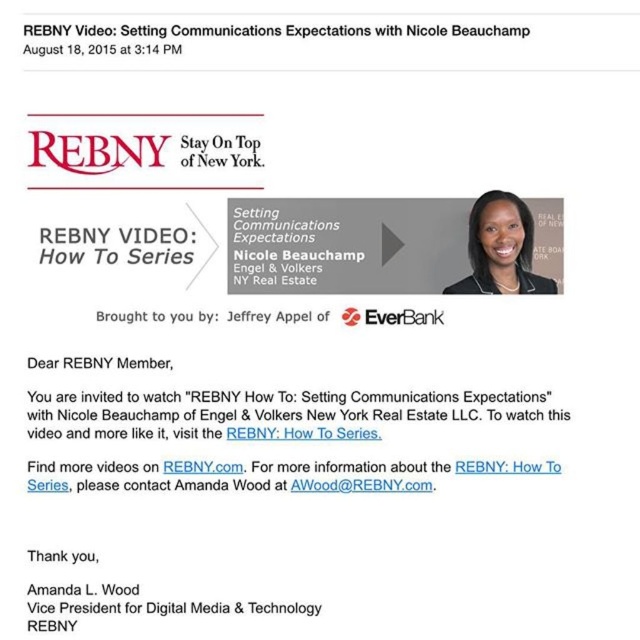
Is point (515, 29) positioned behind point (476, 275)?

No, (515, 29) is in front of (476, 275).

Does white paper at upper center appear on the right side of black glossy hair at upper right?

Incorrect, white paper at upper center is not on the right side of black glossy hair at upper right.

Between point (29, 36) and point (518, 250), which one is positioned in front?

Point (29, 36) is more forward.

Where is `white paper at upper center`? The image size is (640, 640). white paper at upper center is located at coordinates (227, 35).

Can you confirm if black glossy hair at upper right is wider than whitetextured paperrebny: how to series at center?

Indeed, black glossy hair at upper right has a greater width compared to whitetextured paperrebny: how to series at center.

Who is higher up, black glossy hair at upper right or whitetextured paperrebny: how to series at center?

black glossy hair at upper right is higher up.

The image size is (640, 640). What do you see at coordinates (500, 248) in the screenshot?
I see `black glossy hair at upper right` at bounding box center [500, 248].

Where is `black glossy hair at upper right`? Image resolution: width=640 pixels, height=640 pixels. black glossy hair at upper right is located at coordinates (500, 248).

Between point (236, 33) and point (477, 474), which one is positioned behind?

The point (477, 474) is more distant.

Between point (93, 33) and point (460, 464), which one is positioned in front?

Point (93, 33) is in front.

At what (x,y) coordinates should I click in order to perform the action: click on white paper at upper center. Please return your answer as a coordinate pair (x, y). The image size is (640, 640). Looking at the image, I should click on (227, 35).